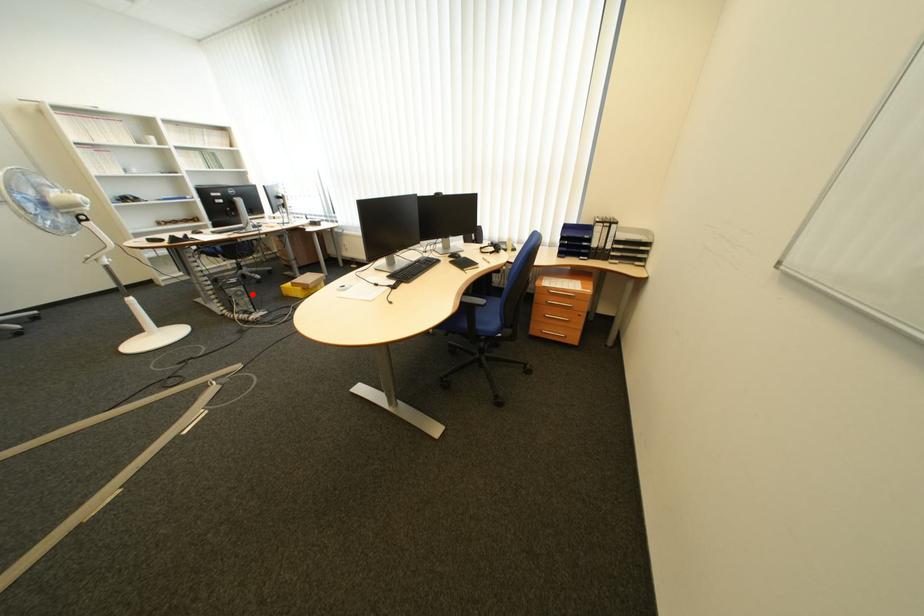
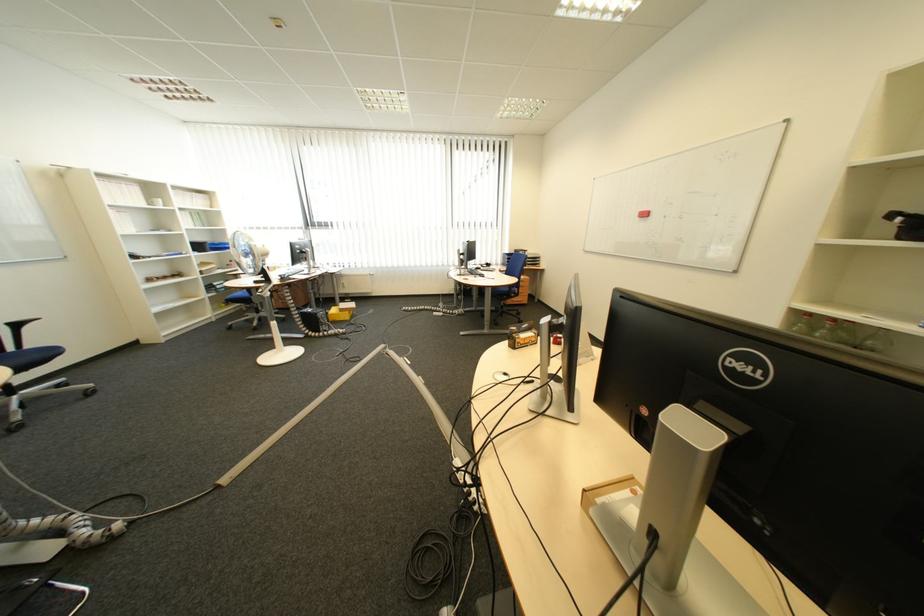
Question: I am providing you with two images of the same scene from different viewpoints. In image1, a red point is highlighted. Considering the same 3D point in image2, which of the following is correct?

Choices:
 (A) It is closer
 (B) It is farther

Answer: (A)